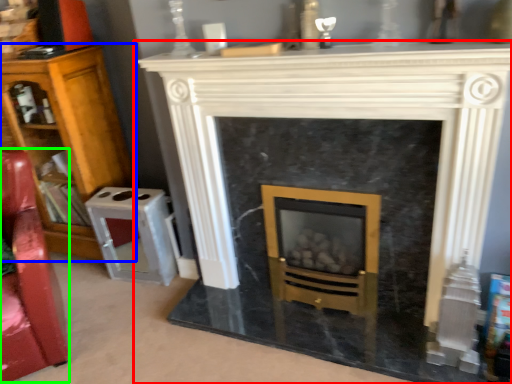
Question: Considering the real-world distances, which object is farthest from fireplace (highlighted by a red box)? bookcase (highlighted by a blue box) or swivel chair (highlighted by a green box)?

Choices:
 (A) bookcase
 (B) swivel chair

Answer: (A)